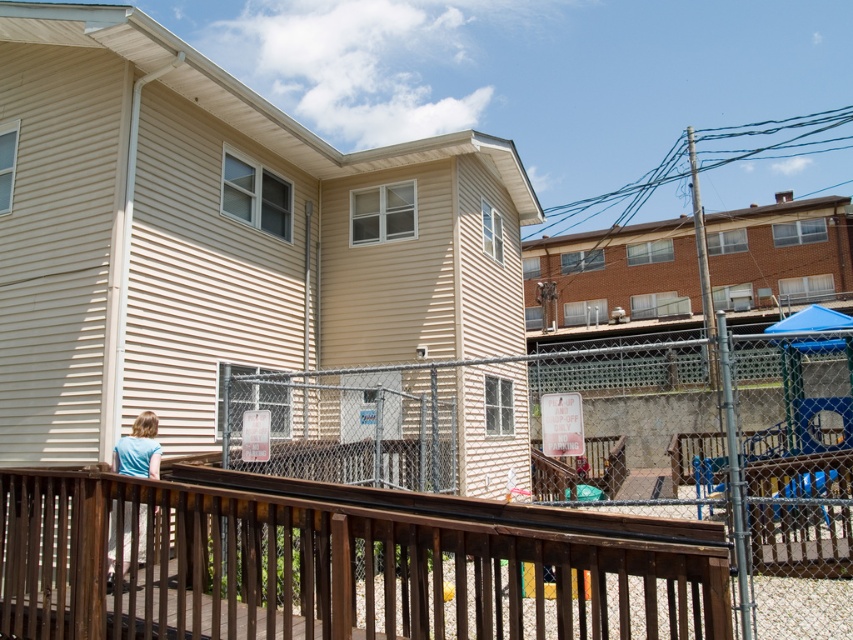
Question: Which point is farther to the camera?

Choices:
 (A) (793, 461)
 (B) (109, 547)
 (C) (48, 488)

Answer: (A)

Question: Which object is positioned closest to the brown wooden railing at lower center?

Choices:
 (A) light blue shirt at lower left
 (B) brown wooden fence at lower center

Answer: (A)

Question: Is brown wooden railing at lower center positioned before light blue shirt at lower left?

Choices:
 (A) yes
 (B) no

Answer: (A)

Question: Can you confirm if brown wooden railing at lower center is wider than light blue shirt at lower left?

Choices:
 (A) no
 (B) yes

Answer: (B)

Question: Which point is farther to the camera?

Choices:
 (A) (131, 580)
 (B) (346, 593)
 (C) (137, 442)

Answer: (C)

Question: Can you confirm if brown wooden railing at lower center is positioned to the left of light blue shirt at lower left?

Choices:
 (A) no
 (B) yes

Answer: (A)